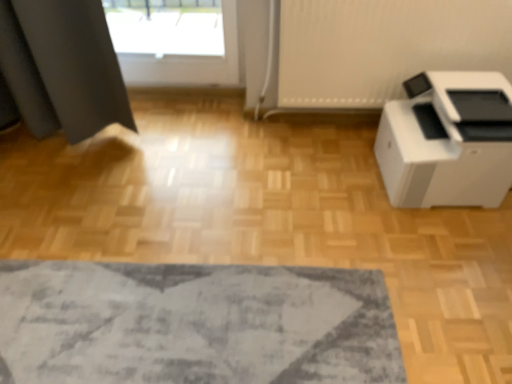
I want to click on vacant area that is situated to the right of textured gray rug at lower center, so click(393, 259).